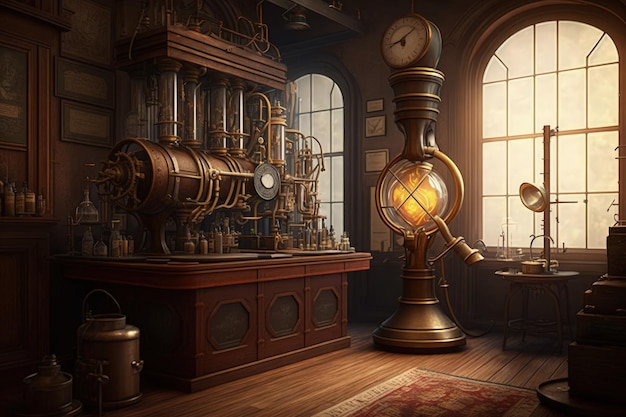
Identify the location of light. Image resolution: width=626 pixels, height=417 pixels. (536, 203).